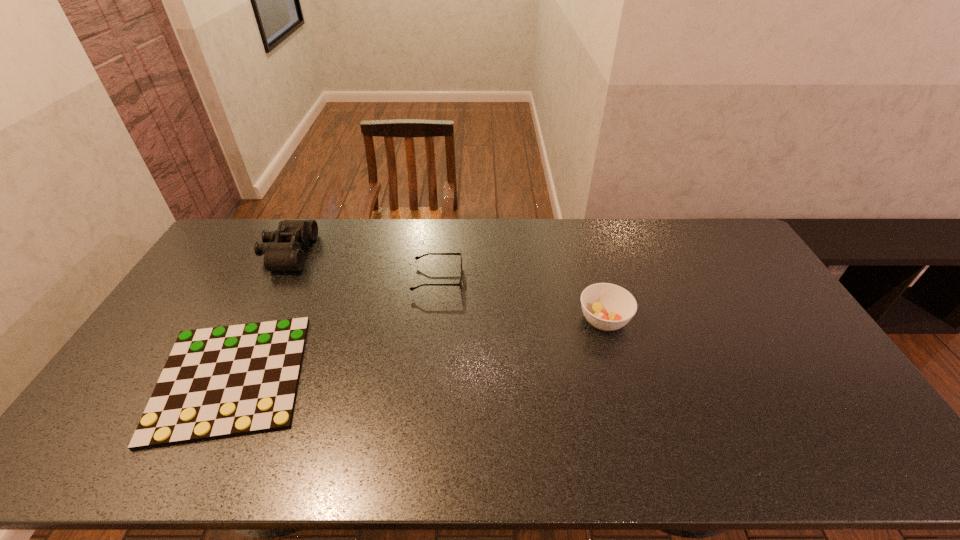
What are the coordinates of `empty space that is in between the tallest object and the shortest object` in the screenshot? It's located at (259, 315).

Locate an element on the screen. The width and height of the screenshot is (960, 540). vacant space that is in between the soup bowl and the shortest object is located at coordinates (418, 348).

I want to click on empty space between the tallest object and the third shortest object, so click(x=446, y=286).

Find the location of a particular element. This screenshot has width=960, height=540. empty space that is in between the soup bowl and the third tallest object is located at coordinates (520, 300).

Image resolution: width=960 pixels, height=540 pixels. Identify the location of blank region between the second object from right to left and the binoculars. (363, 266).

Locate an element on the screen. This screenshot has width=960, height=540. vacant space that's between the shortest object and the binoculars is located at coordinates (259, 315).

What are the coordinates of `object that can be found as the second closest to the rightmost object` in the screenshot? It's located at (218, 382).

Find the location of a particular element. The image size is (960, 540). object that ranks as the third closest to the binoculars is located at coordinates (606, 306).

Locate an element on the screen. vacant space that satisfies the following two spatial constraints: 1. on the front lenses of the second shortest object; 2. on the right side of the third shortest object is located at coordinates [x=433, y=320].

Find the location of a particular element. This screenshot has height=540, width=960. free location that satisfies the following two spatial constraints: 1. at the eyepieces of the second tallest object; 2. on the left side of the tallest object is located at coordinates (253, 320).